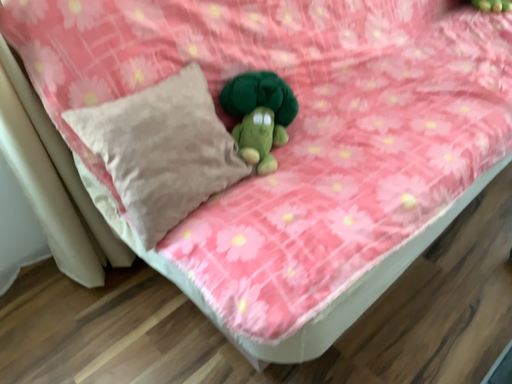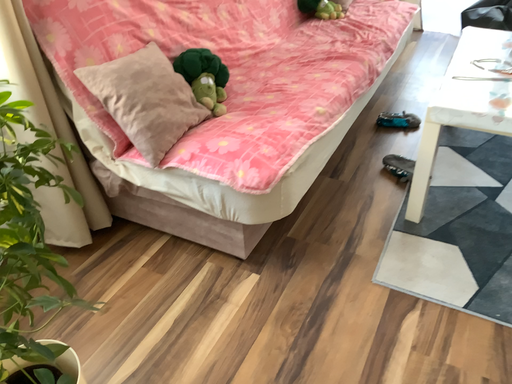
Question: Which way did the camera rotate in the video?

Choices:
 (A) rotated left
 (B) rotated right

Answer: (B)